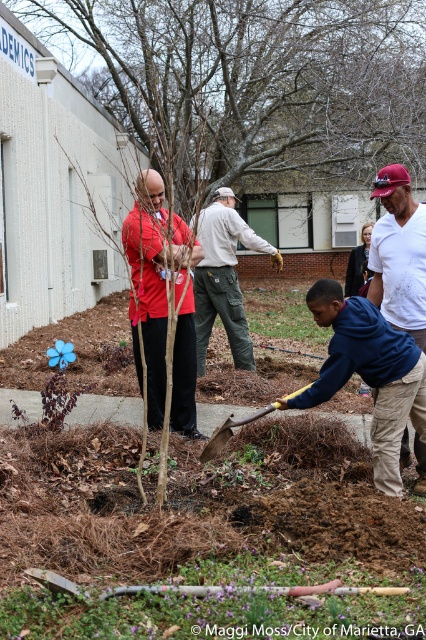
Question: Which point is closer to the camera?

Choices:
 (A) bare branches at center
 (B) blue cotton hoodie at center
 (C) matte red shirt at center

Answer: (A)

Question: Does blue cotton hoodie at center have a lesser width compared to khaki cargo pants at center?

Choices:
 (A) yes
 (B) no

Answer: (B)

Question: Which point is closer to the camera taking this photo?

Choices:
 (A) (210, 276)
 (B) (149, 410)

Answer: (B)

Question: Which object is farther from the camera taking this photo?

Choices:
 (A) bare branches at center
 (B) matte red shirt at center

Answer: (B)

Question: Does blue cotton hoodie at center appear on the right side of khaki cargo pants at center?

Choices:
 (A) yes
 (B) no

Answer: (A)

Question: In this image, where is blue cotton hoodie at center located relative to yellow wood shovel at center?

Choices:
 (A) right
 (B) left

Answer: (A)